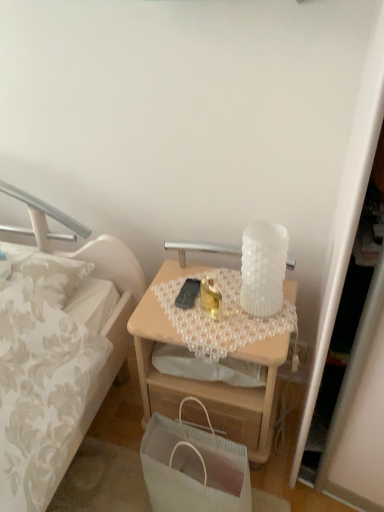
Identify the location of free region on the left part of black matte mobile phone at center. (158, 297).